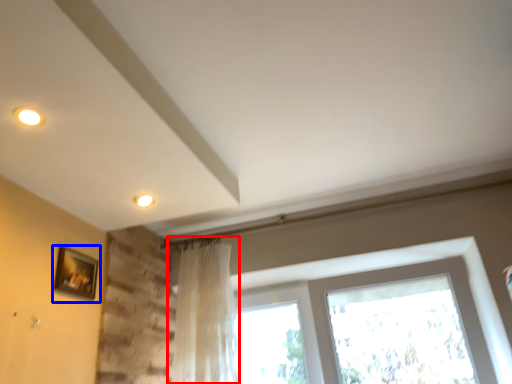
Question: Which object appears closest to the camera in this image, curtain (highlighted by a red box) or picture frame (highlighted by a blue box)?

Choices:
 (A) curtain
 (B) picture frame

Answer: (B)